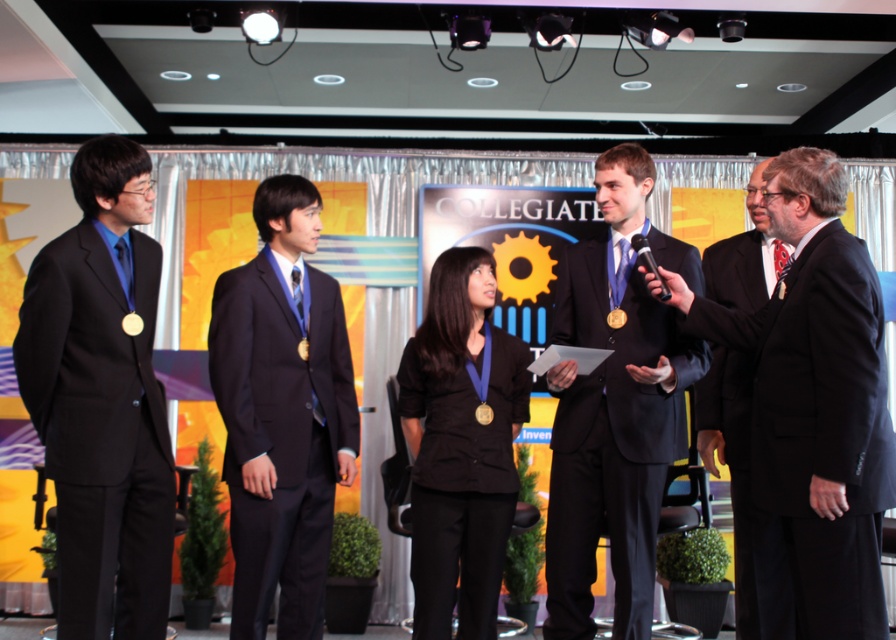
From the picture: You are an event photographer at the awards ceremony. You need to capture a closeup shot of the matte black suit at center and the black matte blazer at center. Which one would appear wider in the photo?

The black matte blazer at center would appear wider in the photo because it has a greater width compared to the matte black suit at center.

You are a photographer positioned at the back of the venue. You want to capture a photo of both the matte black suit at center and the black matte blazer at center in the same frame. Given that your camera has a minimum focus distance of 20 inches, will you be able to focus on both subjects simultaneously?

The distance between the matte black suit at center and the black matte blazer at center is 20.16 inches, which exceeds the camera minimum focus distance of 20 inches. Therefore, the photographer can focus on both subjects simultaneously.